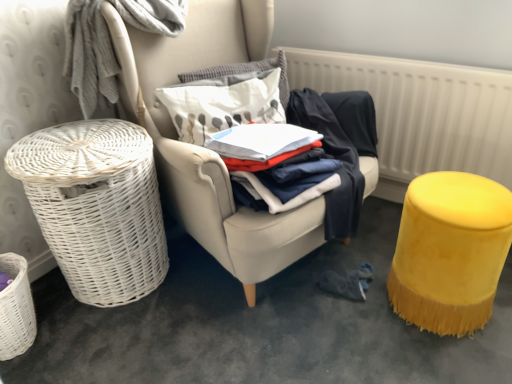
Question: From the image's perspective, is white cotton shirt at center positioned above or below white fabric pillow at center, which is the 2th pillow from top to bottom?

Choices:
 (A) above
 (B) below

Answer: (B)

Question: In the image, is white cotton shirt at center on the left side or the right side of white fabric pillow at center, arranged as the first pillow when ordered from the bottom?

Choices:
 (A) right
 (B) left

Answer: (A)

Question: Based on their relative distances, which object is nearer to the white textured radiator at upper right?

Choices:
 (A) white fabric pillow at center, arranged as the first pillow when ordered from the bottom
 (B) white wicker laundry basket at left
 (C) yellow velvet stool at right
 (D) white cotton shirt at center
 (E) white wicker basket at left

Answer: (D)

Question: Which object is positioned farthest from the yellow velvet stool at right?

Choices:
 (A) white textured pillow at center, which ranks as the first pillow in top-to-bottom order
 (B) white textured radiator at upper right
 (C) white cotton shirt at center
 (D) white wicker basket at left
 (E) white wicker basket at left

Answer: (E)